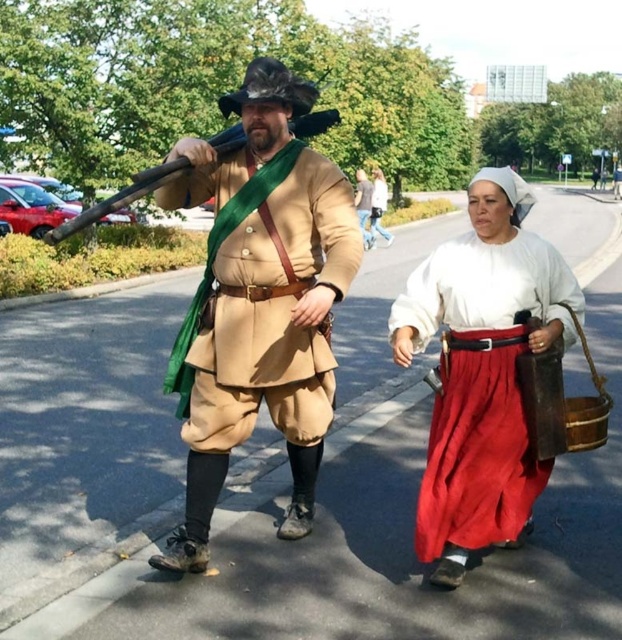
Question: Is matte white blouse at center to the right of matte brown leather purse at center from the viewer's perspective?

Choices:
 (A) yes
 (B) no

Answer: (B)

Question: Can you confirm if matte white blouse at center is positioned above matte brown leather purse at center?

Choices:
 (A) yes
 (B) no

Answer: (B)

Question: Which point is farther to the camera?

Choices:
 (A) (376, 221)
 (B) (455, 572)
 (C) (379, 205)
 (D) (281, 172)

Answer: (C)

Question: Which of the following is the closest to the observer?

Choices:
 (A) matte brown leather outfit at center
 (B) matte brown leather purse at center

Answer: (A)

Question: Based on their relative distances, which object is nearer to the matte brown leather purse at center?

Choices:
 (A) matte white blouse at center
 (B) white linen dress at center
 (C) matte brown leather outfit at center

Answer: (B)

Question: Observing the image, what is the correct spatial positioning of matte brown leather outfit at center in reference to matte white blouse at center?

Choices:
 (A) right
 (B) left

Answer: (B)